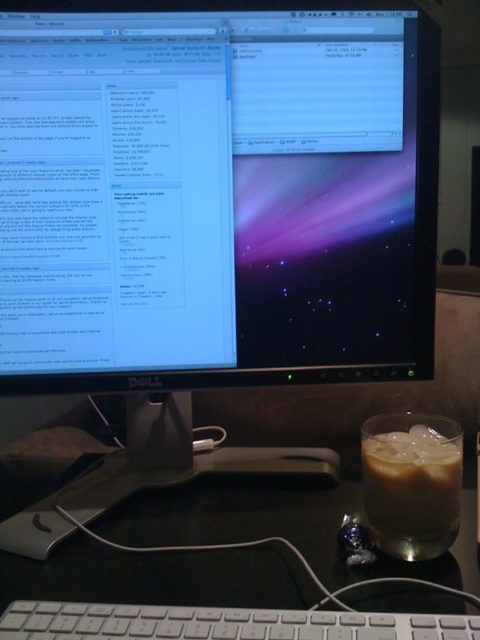
Is the position of white plastic keyboard at bottom less distant than that of iced coffee at right?

Yes, white plastic keyboard at bottom is in front of iced coffee at right.

Does white plastic keyboard at bottom appear over iced coffee at right?

Answer: No.

Between point (204, 628) and point (406, 440), which one is positioned behind?

Positioned behind is point (406, 440).

What are the coordinates of `white plastic keyboard at bottom` in the screenshot? It's located at (220, 624).

Can you confirm if black plastic table at lower center is positioned to the right of white plastic keyboard at bottom?

Correct, you'll find black plastic table at lower center to the right of white plastic keyboard at bottom.

Is black plastic table at lower center bigger than white plastic keyboard at bottom?

Yes, black plastic table at lower center is bigger than white plastic keyboard at bottom.

Where is `black plastic table at lower center`? This screenshot has width=480, height=640. black plastic table at lower center is located at coordinates (168, 584).

Can you confirm if black plastic table at lower center is thinner than iced coffee at right?

Incorrect, black plastic table at lower center's width is not less than iced coffee at right's.

What do you see at coordinates (168, 584) in the screenshot?
I see `black plastic table at lower center` at bounding box center [168, 584].

You are a GUI agent. You are given a task and a screenshot of the screen. Output one action in this format:
    pyautogui.click(x=<x>, y=<y>)
    Task: Click on the black plastic table at lower center
    
    Given the screenshot: What is the action you would take?
    pyautogui.click(x=168, y=584)